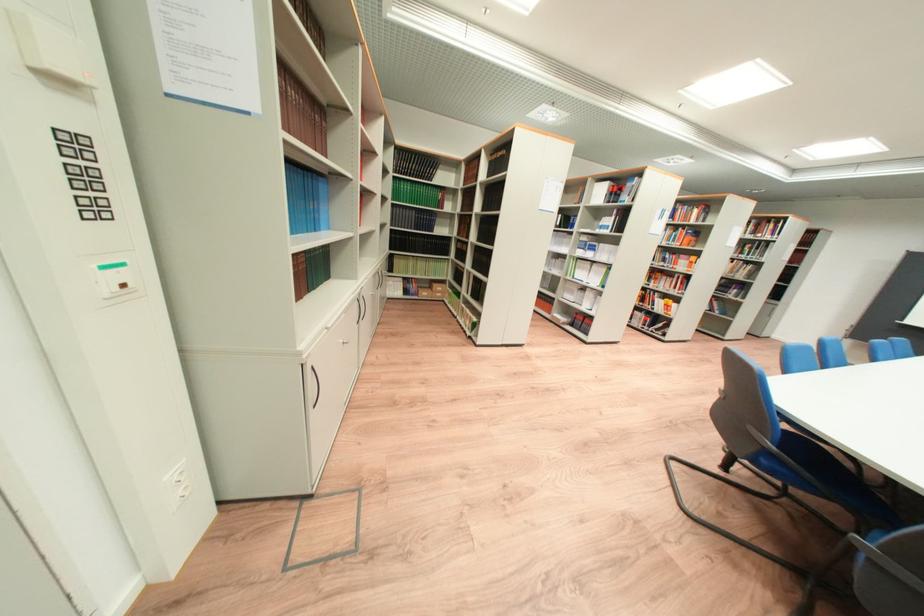
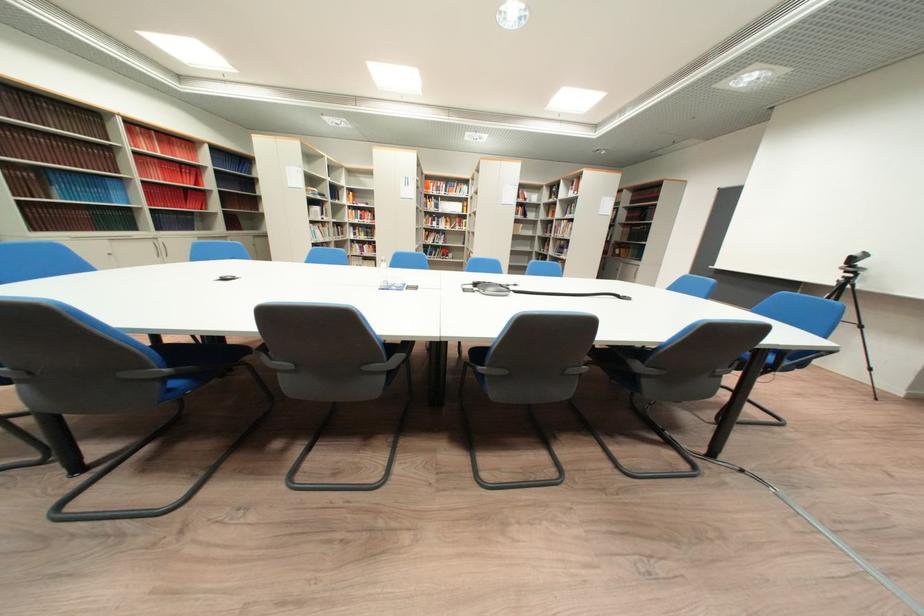
Question: I am providing you with two images of the same scene from different viewpoints. Please identify which objects are invisible in image2.

Choices:
 (A) blue chair sitting surface
 (B) cabinet handle
 (C) black helmet
 (D) grey chair armrest

Answer: (A)